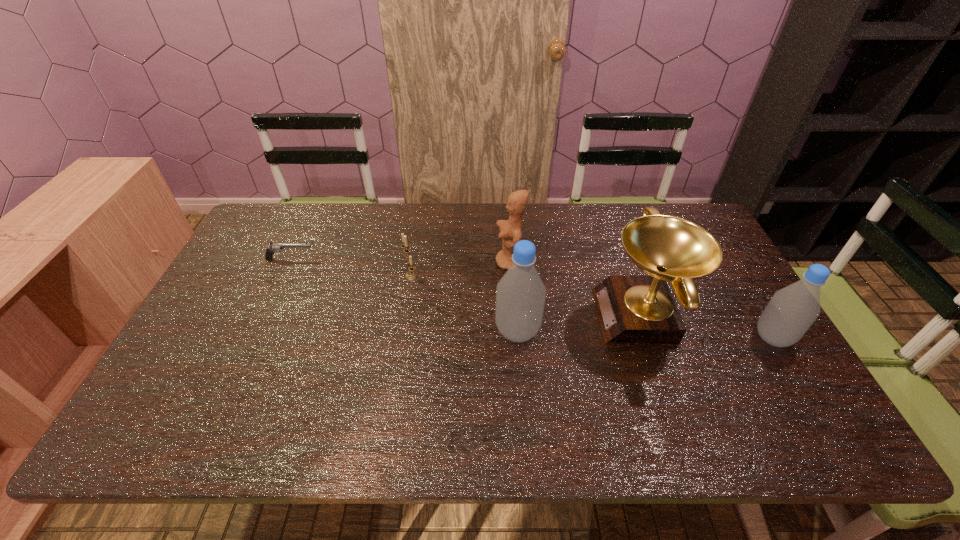
In order to click on free location located 0.190m on the back of the right bottle in this screenshot , I will do `click(734, 274)`.

This screenshot has height=540, width=960. Find the location of `free space located 0.320m on the left of the candle`. free space located 0.320m on the left of the candle is located at coordinates (296, 276).

Locate an element on the screen. This screenshot has width=960, height=540. vacant space located on the front-facing side of the figurine is located at coordinates (409, 262).

Locate an element on the screen. The width and height of the screenshot is (960, 540). vacant area situated 0.290m on the front-facing side of the figurine is located at coordinates (402, 262).

Find the location of `free spot located 0.060m on the front-facing side of the figurine`. free spot located 0.060m on the front-facing side of the figurine is located at coordinates (476, 262).

I want to click on blank space located 0.200m on the front-facing side of the pistol, so click(379, 259).

You are a GUI agent. You are given a task and a screenshot of the screen. Output one action in this format:
    pyautogui.click(x=<x>, y=<y>)
    Task: Click on the vacant space situated 0.310m on the front-facing side of the second object from right to left
    The width and height of the screenshot is (960, 540).
    Given the screenshot: What is the action you would take?
    pyautogui.click(x=486, y=316)

You are a GUI agent. You are given a task and a screenshot of the screen. Output one action in this format:
    pyautogui.click(x=<x>, y=<y>)
    Task: Click on the vacant space located on the front-facing side of the second object from right to left
    
    Given the screenshot: What is the action you would take?
    pyautogui.click(x=559, y=316)

This screenshot has width=960, height=540. Identify the location of vacant space located 0.060m on the front-facing side of the second object from right to left. (577, 316).

The width and height of the screenshot is (960, 540). I want to click on object situated at the near edge, so click(632, 309).